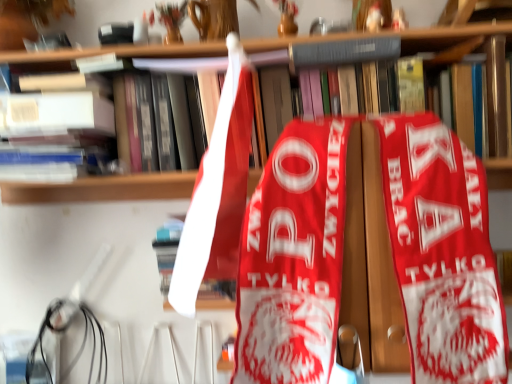
This screenshot has width=512, height=384. I want to click on wooden bookcase at center, so click(101, 189).

Identify the location of black rubber wire at lower left. This screenshot has height=384, width=512. (92, 347).

This screenshot has width=512, height=384. In order to click on wooden bookcase at center in this screenshot , I will do `click(101, 189)`.

Is hardcover book at upper center, the first book when ordered from right to left, shorter than wooden bookcase at center?

Yes.

From a real-world perspective, is hardcover book at upper center, which is the 1th book in top-to-bottom order, positioned over wooden bookcase at center based on gravity?

Correct, in the physical world, hardcover book at upper center, which is the 1th book in top-to-bottom order, is higher than wooden bookcase at center.

Is point (379, 60) positioned after point (447, 44)?

That is True.

Considering the relative positions of hardcover book at upper center, the first book when ordered from right to left, and wooden bookcase at center in the image provided, is hardcover book at upper center, the first book when ordered from right to left, to the left of wooden bookcase at center from the viewer's perspective?

In fact, hardcover book at upper center, the first book when ordered from right to left, is to the right of wooden bookcase at center.

Find the location of a particular element. The width and height of the screenshot is (512, 384). book located behind the hardcover book at upper center, which ranks as the second book in bottom-to-top order is located at coordinates (56, 127).

Is matte white book at upper left, which is the 1th book from left to right, spatially inside hardcover book at upper center, the first book when ordered from right to left, or outside of it?

matte white book at upper left, which is the 1th book from left to right, is outside hardcover book at upper center, the first book when ordered from right to left.

Is point (83, 118) closer or farther from the camera than point (304, 47)?

Point (83, 118) is positioned closer to the camera compared to point (304, 47).

From a real-world perspective, does hardcover book at upper center, which ranks as the second book in bottom-to-top order, sit lower than matte white book at upper left, which is the 1th book from left to right?

No, from a real-world perspective, hardcover book at upper center, which ranks as the second book in bottom-to-top order, is not under matte white book at upper left, which is the 1th book from left to right.

Is matte white book at upper left, which is the 1th book from left to right, surrounded by hardcover book at upper center, which is the 1th book in top-to-bottom order?

Actually, matte white book at upper left, which is the 1th book from left to right, is outside hardcover book at upper center, which is the 1th book in top-to-bottom order.

Which of these two, hardcover book at upper center, the second book from the left, or matte white book at upper left, which is the 1th book from left to right, stands shorter?

hardcover book at upper center, the second book from the left.

Is hardcover book at upper center, which is the 1th book in top-to-bottom order, positioned far away from matte white book at upper left, which appears as the 2th book when viewed from the top?

No.

Is wooden bookcase at center facing away from black rubber wire at lower left?

No, wooden bookcase at center is not facing the opposite direction of black rubber wire at lower left.

Do you think wooden bookcase at center is within black rubber wire at lower left, or outside of it?

wooden bookcase at center is not enclosed by black rubber wire at lower left.

In terms of size, does wooden bookcase at center appear bigger or smaller than black rubber wire at lower left?

Clearly, wooden bookcase at center is larger in size than black rubber wire at lower left.

Does point (488, 173) come behind point (37, 349)?

No, it is in front of (37, 349).

Is the position of hardcover book at upper center, the first book when ordered from right to left, less distant than that of black rubber wire at lower left?

Yes, hardcover book at upper center, the first book when ordered from right to left, is in front of black rubber wire at lower left.

Considering the sizes of objects hardcover book at upper center, which ranks as the second book in bottom-to-top order, and black rubber wire at lower left in the image provided, who is smaller, hardcover book at upper center, which ranks as the second book in bottom-to-top order, or black rubber wire at lower left?

Smaller between the two is hardcover book at upper center, which ranks as the second book in bottom-to-top order.

Is black rubber wire at lower left inside hardcover book at upper center, which ranks as the second book in bottom-to-top order?

No.

Would you consider hardcover book at upper center, which is the 1th book in top-to-bottom order, to be distant from black rubber wire at lower left?

That's not correct — hardcover book at upper center, which is the 1th book in top-to-bottom order, is a little close to black rubber wire at lower left.

Is matte white book at upper left, which appears as the 2th book when viewed from the top, bigger or smaller than wooden bookcase at center?

matte white book at upper left, which appears as the 2th book when viewed from the top, is smaller than wooden bookcase at center.

Considering the relative sizes of matte white book at upper left, which appears as the 2th book when viewed from the top, and wooden bookcase at center in the image provided, is matte white book at upper left, which appears as the 2th book when viewed from the top, taller than wooden bookcase at center?

In fact, matte white book at upper left, which appears as the 2th book when viewed from the top, may be shorter than wooden bookcase at center.

Is matte white book at upper left, which is the 1th book from left to right, facing towards wooden bookcase at center?

No, matte white book at upper left, which is the 1th book from left to right, is not aimed at wooden bookcase at center.

Is the depth of matte white book at upper left, arranged as the first book when ordered from the bottom, greater than that of wooden bookcase at center?

Yes, it is.

Between point (44, 156) and point (102, 357), which one is positioned in front?

The point (44, 156) is more forward.

In the scene shown: From a real-world perspective, is matte white book at upper left, which appears as the 2th book when viewed from the top, located higher than black rubber wire at lower left?

Yes, from a real-world perspective, matte white book at upper left, which appears as the 2th book when viewed from the top, is above black rubber wire at lower left.

What's the angular difference between matte white book at upper left, which is the second book from right to left, and black rubber wire at lower left's facing directions?

0.925 degrees separate the facing orientations of matte white book at upper left, which is the second book from right to left, and black rubber wire at lower left.

The width and height of the screenshot is (512, 384). Identify the location of wire behind the matte white book at upper left, which is the second book from right to left. (92, 347).

Locate an element on the screen. The image size is (512, 384). book that appears on the right of wooden bookcase at center is located at coordinates (343, 52).

I want to click on book located below the hardcover book at upper center, the first book when ordered from right to left (from the image's perspective), so click(56, 127).

Based on their spatial positions, is black rubber wire at lower left or matte white book at upper left, which is the 1th book from left to right, closer to wooden bookcase at center?

matte white book at upper left, which is the 1th book from left to right, is positioned closer to the anchor wooden bookcase at center.

Looking at the image, which one is located further to hardcover book at upper center, which is the 1th book in top-to-bottom order, black rubber wire at lower left or wooden bookcase at center?

black rubber wire at lower left is positioned further to the anchor hardcover book at upper center, which is the 1th book in top-to-bottom order.

Based on their spatial positions, is hardcover book at upper center, which is the 1th book in top-to-bottom order, or wooden bookcase at center further from matte white book at upper left, which is the 1th book from left to right?

Among the two, hardcover book at upper center, which is the 1th book in top-to-bottom order, is located further to matte white book at upper left, which is the 1th book from left to right.

Based on their spatial positions, is matte white book at upper left, which appears as the 2th book when viewed from the top, or black rubber wire at lower left further from hardcover book at upper center, which ranks as the second book in bottom-to-top order?

black rubber wire at lower left.

Based on their spatial positions, is matte white book at upper left, which is the 1th book from left to right, or black rubber wire at lower left further from wooden bookcase at center?

Among the two, black rubber wire at lower left is located further to wooden bookcase at center.

Which object lies further to the anchor point black rubber wire at lower left, hardcover book at upper center, which is the 1th book in top-to-bottom order, or matte white book at upper left, which appears as the 2th book when viewed from the top?

hardcover book at upper center, which is the 1th book in top-to-bottom order, is positioned further to the anchor black rubber wire at lower left.

Based on the photo, looking at the image, which one is located closer to wooden bookcase at center, matte white book at upper left, which is the 1th book from left to right, or hardcover book at upper center, the second book from the left?

Among the two, hardcover book at upper center, the second book from the left, is located nearer to wooden bookcase at center.

Considering their positions, is hardcover book at upper center, the first book when ordered from right to left, positioned closer to wooden bookcase at center than black rubber wire at lower left?

hardcover book at upper center, the first book when ordered from right to left, lies closer to wooden bookcase at center than the other object.

This screenshot has width=512, height=384. In order to click on book situated between black rubber wire at lower left and hardcover book at upper center, the first book when ordered from right to left, from left to right in this screenshot , I will do `click(56, 127)`.

Image resolution: width=512 pixels, height=384 pixels. Identify the location of book between black rubber wire at lower left and wooden bookcase at center. (56, 127).

Locate an element on the screen. bookcase between matte white book at upper left, which is the 1th book from left to right, and hardcover book at upper center, the second book from the left is located at coordinates (101, 189).

At what (x,y) coordinates should I click in order to perform the action: click on bookcase situated between black rubber wire at lower left and hardcover book at upper center, which ranks as the second book in bottom-to-top order, from left to right. Please return your answer as a coordinate pair (x, y). Image resolution: width=512 pixels, height=384 pixels. Looking at the image, I should click on point(101,189).